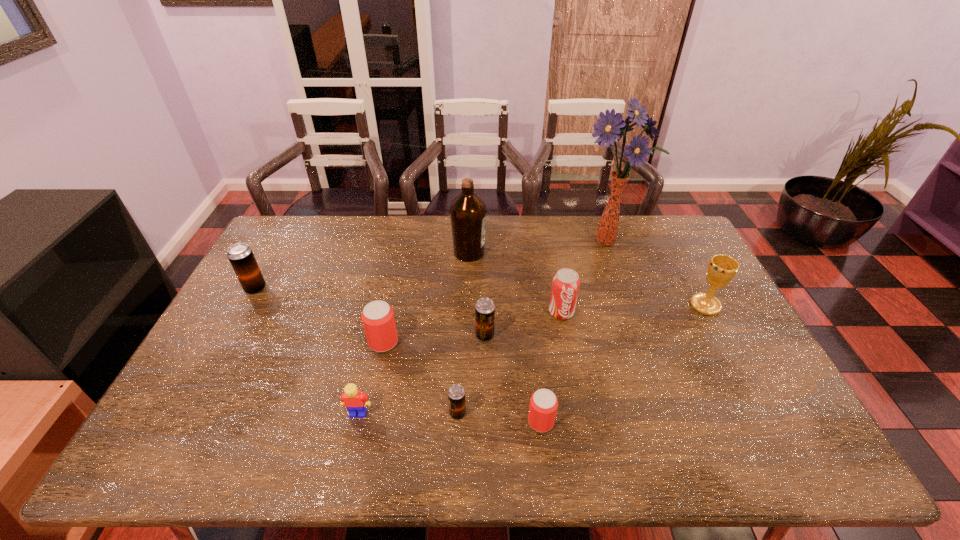
In order to click on beer can that is the third closest one to the left red beer can in this screenshot , I will do `click(543, 406)`.

Locate an element on the screen. the closest black beer can to the Lego is located at coordinates (456, 394).

Select which black beer can is the second closest to the second black beer can from left to right. Please provide its 2D coordinates. Your answer should be formatted as a tuple, i.e. [(x, y)], where the tuple contains the x and y coordinates of a point satisfying the conditions above.

[(241, 257)]

Locate an element on the screen. The image size is (960, 540). free spot that satisfies the following two spatial constraints: 1. on the label of the olive oil; 2. on the front-facing side of the Lego is located at coordinates (465, 413).

Find the location of a particular element. vacant area that satisfies the following two spatial constraints: 1. on the front side of the second black beer can from right to left; 2. on the left side of the bigger red beer can is located at coordinates (369, 413).